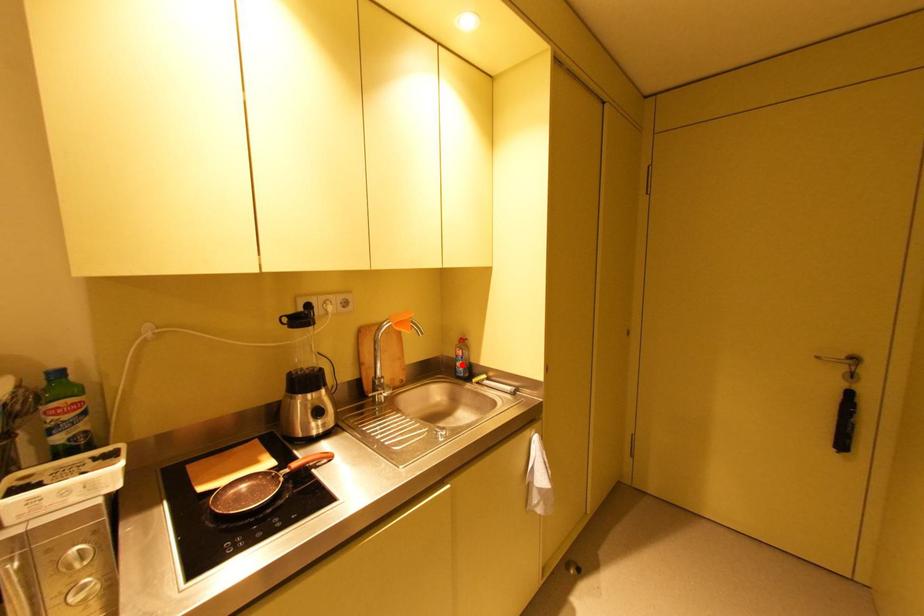
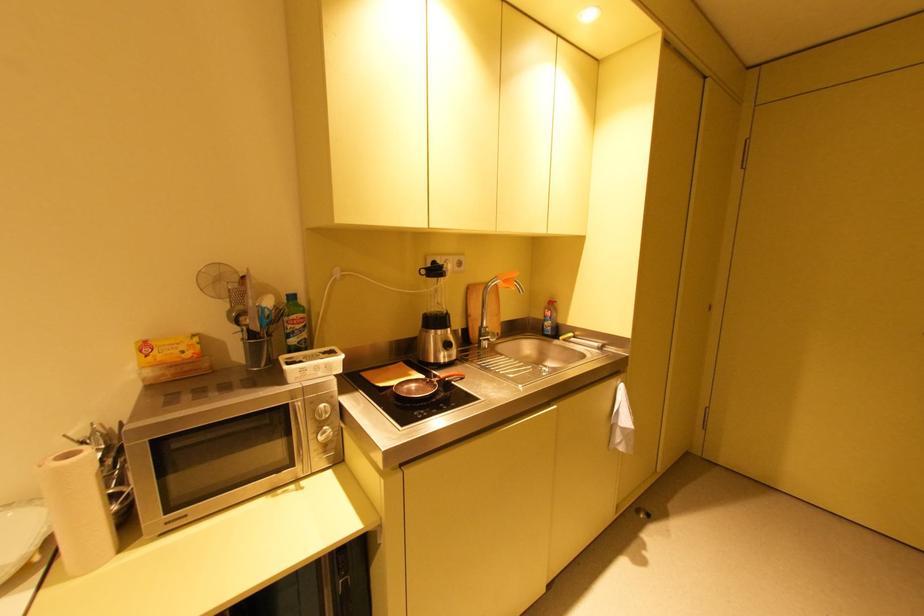
Where in the second image is the point corresponding to the highlighted location from the first image?

(551, 323)